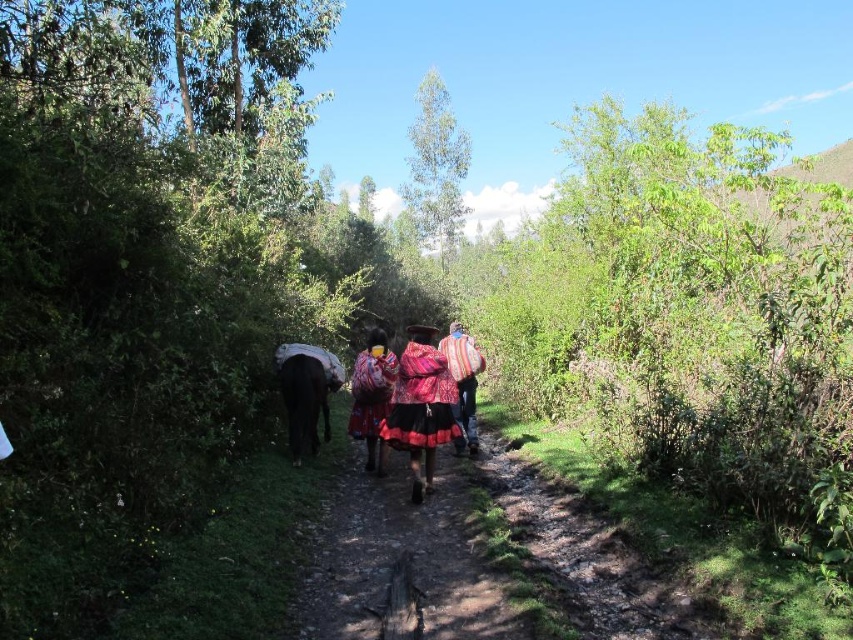
Question: Which of these objects is positioned closest to the multicolored woven shawl at center?

Choices:
 (A) multicolored woven skirt at center
 (B) textured woolen shawl at center

Answer: (A)

Question: Does multicolored woven skirt at center have a larger size compared to multicolored woven shawl at center?

Choices:
 (A) no
 (B) yes

Answer: (B)

Question: Among these points, which one is farthest from the camera?

Choices:
 (A) (363, 397)
 (B) (492, 528)

Answer: (A)

Question: Does multicolored woven skirt at center lie in front of textured woolen shawl at center?

Choices:
 (A) no
 (B) yes

Answer: (B)

Question: Based on their relative distances, which object is nearer to the dusty brown dirt path at center?

Choices:
 (A) multicolored woven skirt at center
 (B) textured woolen shawl at center

Answer: (A)

Question: Can you confirm if multicolored woven skirt at center is positioned to the left of textured woolen shawl at center?

Choices:
 (A) yes
 (B) no

Answer: (A)